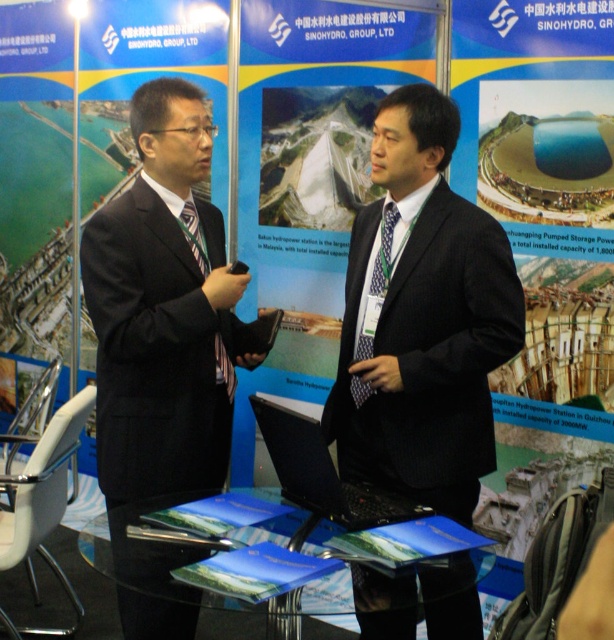
Is black suit at left below blue dotted tie at center?

No, black suit at left is not below blue dotted tie at center.

This screenshot has width=614, height=640. Find the location of `black suit at left`. black suit at left is located at coordinates (163, 310).

Where is `black suit at left`? This screenshot has height=640, width=614. black suit at left is located at coordinates (163, 310).

Can you confirm if dark blue suit at center is positioned to the left of blue dotted tie at center?

No, dark blue suit at center is not to the left of blue dotted tie at center.

Is the position of dark blue suit at center more distant than that of blue dotted tie at center?

No, dark blue suit at center is in front of blue dotted tie at center.

This screenshot has width=614, height=640. Identify the location of dark blue suit at center. coord(421,317).

Is blue dotted tie at center to the right of matte black tie at center from the viewer's perspective?

Indeed, blue dotted tie at center is positioned on the right side of matte black tie at center.

Who is higher up, blue dotted tie at center or matte black tie at center?

matte black tie at center is higher up.

Locate an element on the screen. The image size is (614, 640). blue dotted tie at center is located at coordinates pos(383,252).